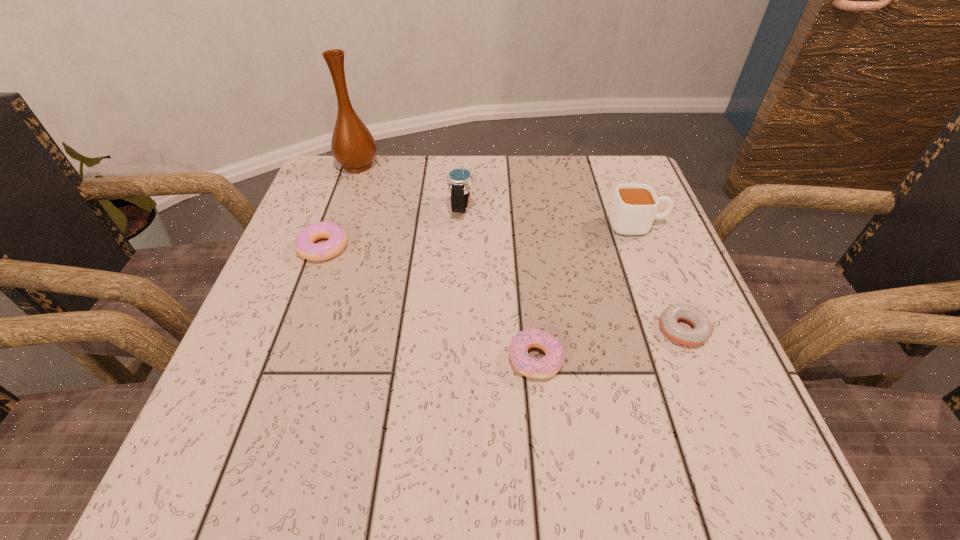
Find the location of a particular element. Image resolution: width=960 pixels, height=540 pixels. free point that satisfies the following two spatial constraints: 1. on the back side of the rightmost doughnut; 2. on the side with the handle of the cup is located at coordinates (641, 225).